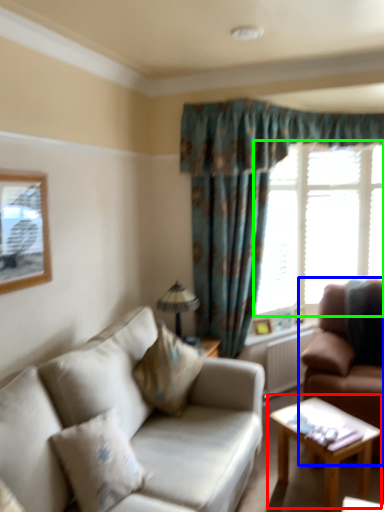
Question: Which object is positioned farthest from coffee table (highlighted by a red box)? Select from studio couch (highlighted by a blue box) and window (highlighted by a green box).

Choices:
 (A) studio couch
 (B) window

Answer: (B)